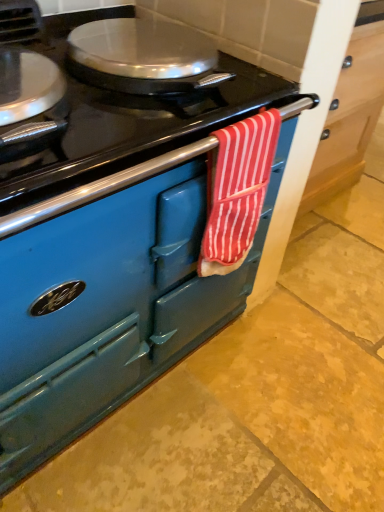
This screenshot has height=512, width=384. What do you see at coordinates (237, 191) in the screenshot?
I see `red striped towel at center` at bounding box center [237, 191].

In order to face red striped towel at center, should I rotate leftwards or rightwards?

Turn right approximately 5.404 degrees to face it.

Identify the location of red striped towel at center. This screenshot has width=384, height=512. (237, 191).

Where is `matte blue oven at center`? Image resolution: width=384 pixels, height=512 pixels. matte blue oven at center is located at coordinates (109, 306).

From the picture: Measure the distance between matte blue oven at center and camera.

25.85 inches.

Describe the element at coordinates (109, 306) in the screenshot. The width and height of the screenshot is (384, 512). I see `matte blue oven at center` at that location.

Identify the location of red striped towel at center. The width and height of the screenshot is (384, 512). (237, 191).

Which is more to the left, red striped towel at center or matte blue oven at center?

red striped towel at center is more to the left.

Does red striped towel at center come behind matte blue oven at center?

Yes.

Which point is more distant from viewer, (230, 161) or (112, 308)?

Point (112, 308)

From the image's perspective, between red striped towel at center and matte blue oven at center, who is located below?

matte blue oven at center, from the image's perspective.

From a real-world perspective, who is located higher, red striped towel at center or matte blue oven at center?

From a 3D spatial view, red striped towel at center is above.

Which of these two, red striped towel at center or matte blue oven at center, is wider?

With larger width is matte blue oven at center.

Considering the relative sizes of red striped towel at center and matte blue oven at center in the image provided, is red striped towel at center taller than matte blue oven at center?

Indeed, red striped towel at center has a greater height compared to matte blue oven at center.

Considering the sizes of objects red striped towel at center and matte blue oven at center in the image provided, who is bigger, red striped towel at center or matte blue oven at center?

Bigger between the two is matte blue oven at center.

Is matte blue oven at center inside red striped towel at center?

Actually, matte blue oven at center is outside red striped towel at center.

Is red striped towel at center not near matte blue oven at center?

No.

Does red striped towel at center turn towards matte blue oven at center?

No, red striped towel at center is not aimed at matte blue oven at center.

What's the angular difference between red striped towel at center and matte blue oven at center's facing directions?

180 degrees.

Find the location of a particular element. The image size is (384, 512). cabinetry in front of the red striped towel at center is located at coordinates click(x=109, y=306).

Which object is positioned more to the left, matte blue oven at center or red striped towel at center?

red striped towel at center.

Is matte blue oven at center positioned in front of red striped towel at center?

Yes, the depth of matte blue oven at center is less than that of red striped towel at center.

Which is further, (77, 294) or (237, 188)?

The point (237, 188) is farther from the camera.

From the image's perspective, relative to red striped towel at center, is matte blue oven at center above or below?

matte blue oven at center is situated lower than red striped towel at center in the image.

From a real-world perspective, relative to red striped towel at center, is matte blue oven at center vertically above or below?

Clearly, from a real-world perspective, matte blue oven at center is below red striped towel at center.

Considering the sizes of objects matte blue oven at center and red striped towel at center in the image provided, who is wider, matte blue oven at center or red striped towel at center?

matte blue oven at center.

Considering the relative sizes of matte blue oven at center and red striped towel at center in the image provided, is matte blue oven at center taller than red striped towel at center?

Incorrect, the height of matte blue oven at center is not larger of that of red striped towel at center.

Which of these two, matte blue oven at center or red striped towel at center, is bigger?

matte blue oven at center is bigger.

Is matte blue oven at center not within red striped towel at center?

Absolutely, matte blue oven at center is external to red striped towel at center.

Would you consider matte blue oven at center to be distant from red striped towel at center?

→ That's not correct — matte blue oven at center is a little close to red striped towel at center.

Is matte blue oven at center positioned with its back to red striped towel at center?

No, matte blue oven at center is not facing the opposite direction of red striped towel at center.

Identify the location of beach towel that is behind the matte blue oven at center. This screenshot has height=512, width=384. (237, 191).

Locate an element on the screen. cabinetry below the red striped towel at center (from the image's perspective) is located at coordinates (109, 306).

Identify the location of cabinetry located underneath the red striped towel at center (from a real-world perspective). This screenshot has width=384, height=512. (109, 306).